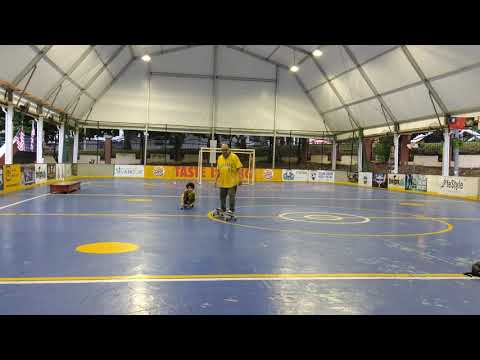
Locate an element on the screen. light source is located at coordinates (317, 51), (293, 68), (146, 57).